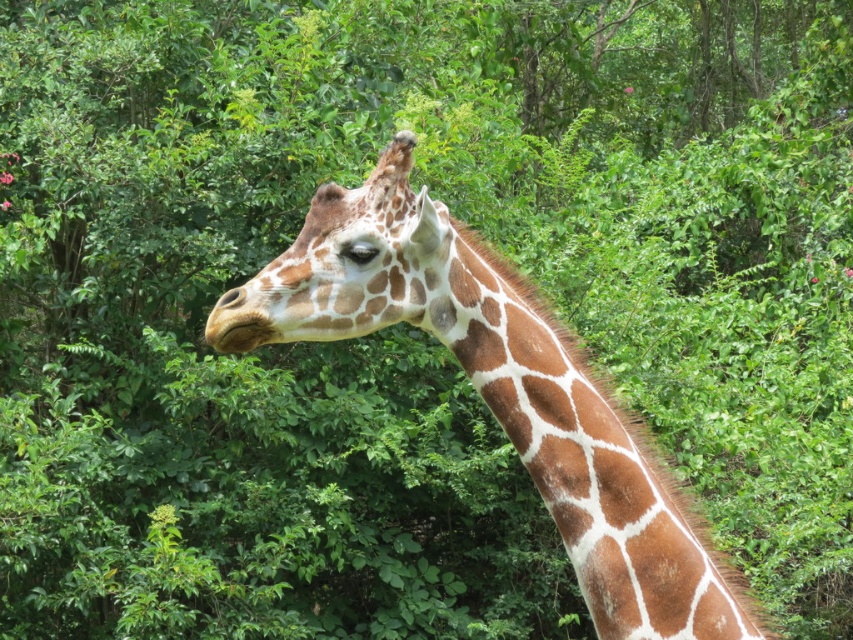
Does brown spotted fur at center have a smaller size compared to brown textured neck at center?

No, brown spotted fur at center is not smaller than brown textured neck at center.

Does brown spotted fur at center have a lesser height compared to brown textured neck at center?

No, brown spotted fur at center is not shorter than brown textured neck at center.

This screenshot has height=640, width=853. What do you see at coordinates (502, 392) in the screenshot?
I see `brown spotted fur at center` at bounding box center [502, 392].

The image size is (853, 640). I want to click on brown spotted fur at center, so click(502, 392).

Is brown textured neck at center smaller than brown spotted skin at center?

Actually, brown textured neck at center might be larger than brown spotted skin at center.

Between point (587, 541) and point (364, 200), which one is positioned behind?

The point (364, 200) is more distant.

Where is `brown textured neck at center`? brown textured neck at center is located at coordinates (592, 468).

Is brown spotted fur at center positioned at the back of brown spotted skin at center?

That is False.

Who is more distant from viewer, [396,305] or [386,296]?

Point [386,296]

The image size is (853, 640). Identify the location of brown spotted fur at center. (502, 392).